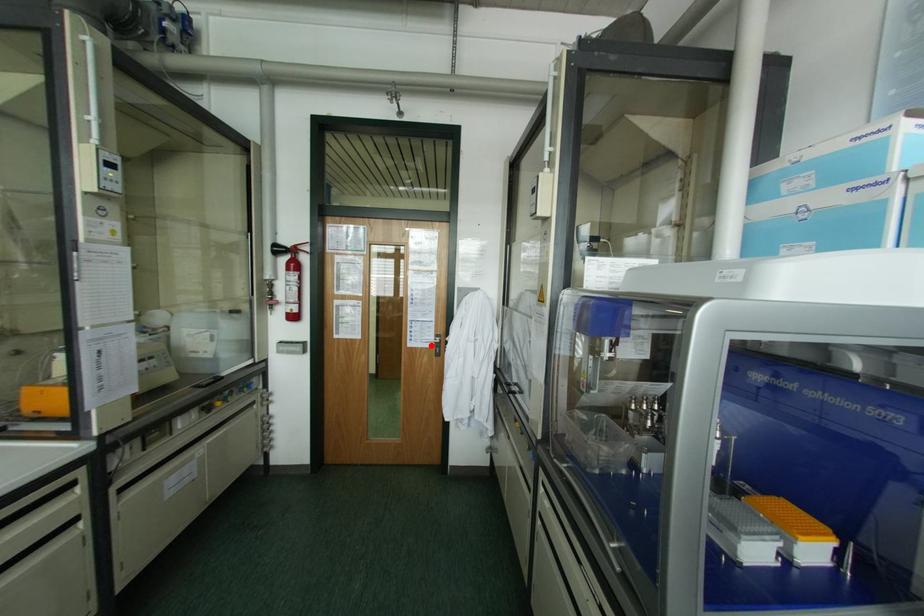
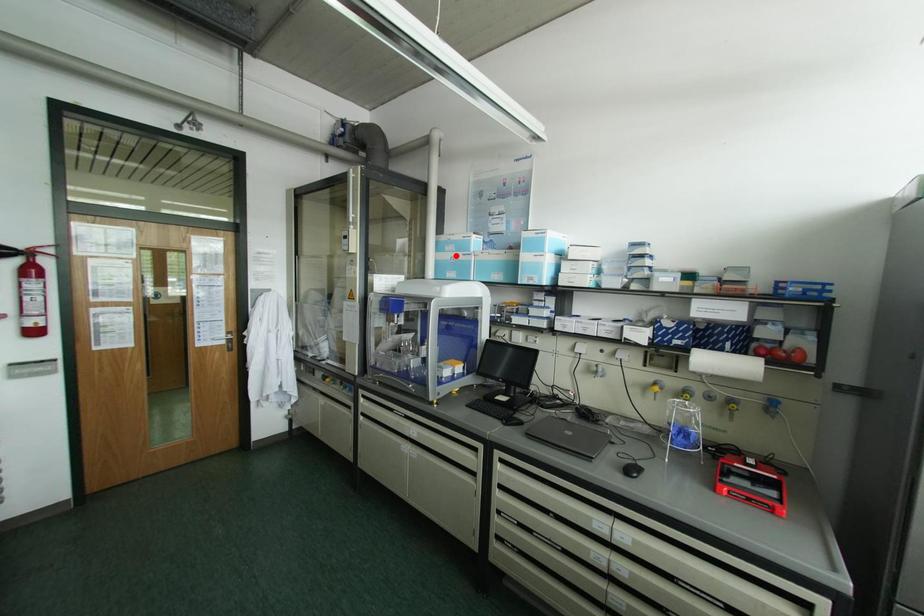
I am providing you with two images of the same scene from different viewpoints. A red point is marked on the first image and another point is marked on the second image. Do the highlighted points in image1 and image2 indicate the same real-world spot?

No